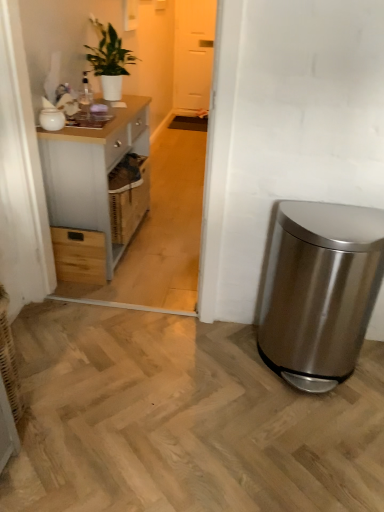
I want to click on vacant space behind white glossy jar at upper left, so click(81, 120).